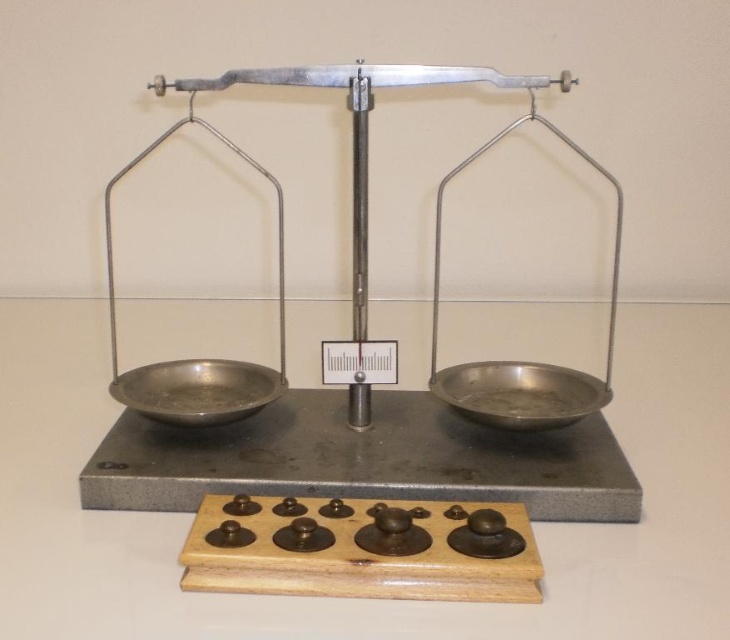
Which is more to the right, metallic scale at center or metallic silver bowl at right?

metallic silver bowl at right

Is metallic scale at center bigger than metallic silver bowl at right?

Correct, metallic scale at center is larger in size than metallic silver bowl at right.

Which is behind, point (426, 404) or point (487, 384)?

The point (426, 404) is behind.

Find the location of a particular element. The width and height of the screenshot is (730, 640). metallic scale at center is located at coordinates (395, 438).

Is point (376, 438) farther from camera compared to point (295, 506)?

Yes, point (376, 438) is behind point (295, 506).

Can you confirm if metallic scale at center is positioned to the right of wooden tray at center?

Indeed, metallic scale at center is positioned on the right side of wooden tray at center.

This screenshot has height=640, width=730. I want to click on metallic scale at center, so click(395, 438).

Is metallic scale at center thinner than polished metal bowl at left?

No, metallic scale at center is not thinner than polished metal bowl at left.

Who is lower down, metallic scale at center or polished metal bowl at left?

polished metal bowl at left

Describe the element at coordinates (395, 438) in the screenshot. I see `metallic scale at center` at that location.

You are a GUI agent. You are given a task and a screenshot of the screen. Output one action in this format:
    pyautogui.click(x=<x>, y=<y>)
    Task: Click on the metallic scale at center
    The width and height of the screenshot is (730, 640).
    Given the screenshot: What is the action you would take?
    pyautogui.click(x=395, y=438)